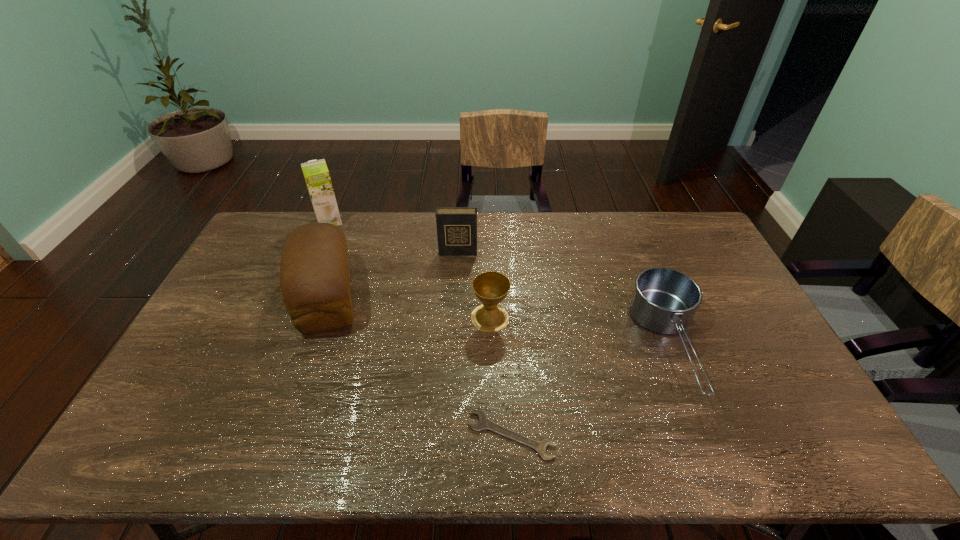
Find the location of a particular element. soya milk is located at coordinates click(316, 174).

Identify the location of the farthest object. (316, 174).

Identify the location of bread. This screenshot has height=540, width=960. (314, 272).

Locate an element on the screen. the second farthest object is located at coordinates (456, 226).

Identify the location of diary. Image resolution: width=960 pixels, height=540 pixels. (456, 226).

Find the location of a particular element. The image size is (960, 540). chalice is located at coordinates (491, 288).

The height and width of the screenshot is (540, 960). In order to click on the rightmost object in this screenshot , I will do `click(663, 300)`.

Locate an element on the screen. The height and width of the screenshot is (540, 960). saucepan is located at coordinates (663, 300).

Locate an element on the screen. The height and width of the screenshot is (540, 960). the shortest object is located at coordinates (484, 423).

Where is `vacant area located on the front of the soya milk`? The width and height of the screenshot is (960, 540). vacant area located on the front of the soya milk is located at coordinates (307, 273).